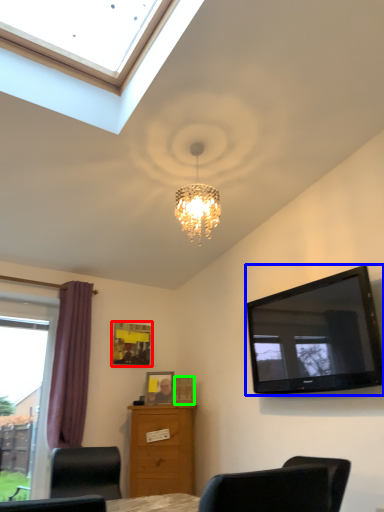
Question: Based on their relative distances, which object is farther from picture frame (highlighted by a red box)? Choose from television (highlighted by a blue box) and picture frame (highlighted by a green box).

Choices:
 (A) television
 (B) picture frame

Answer: (A)